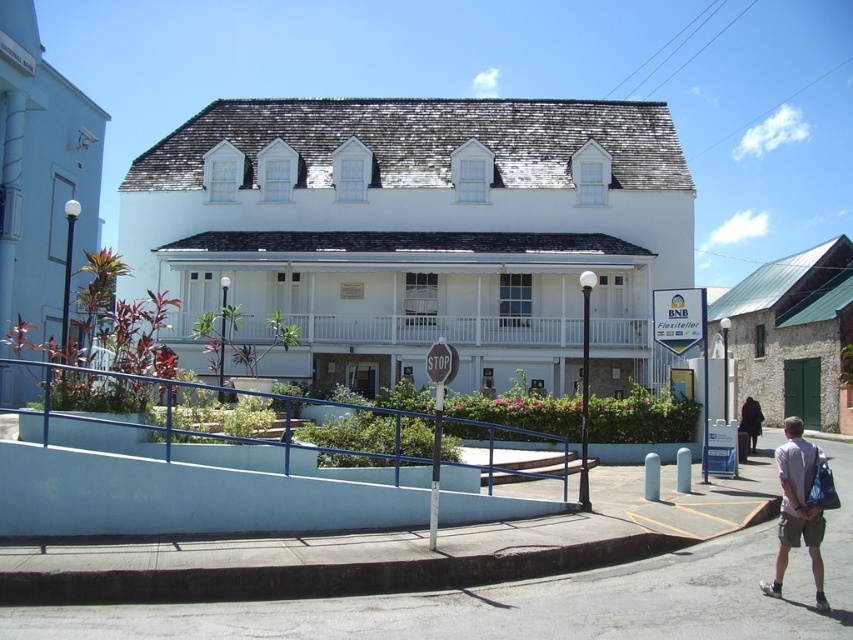
You are a delivery person trying to place a dark brown leather jacket at lower right on the blue metal railing at center. Can you do this without the jacket falling off?

The blue metal railing at center has a lesser height compared to dark brown leather jacket at lower right, so the jacket might not stay securely on the railing and could fall off.

You are a delivery person trying to park your van near the building. The van is 2 meters wide. There is a blue metal railing at center and a dark brown leather jacket at lower right in the image. Which object is wider, and will the van fit between them?

The blue metal railing at center is wider than the dark brown leather jacket at lower right. Since the van is 2 meters wide, it depends on the combined space between them. However, the description only states the railing is wider, not the exact distance. Without knowing the total space, we can only confirm the railing is wider, but cannot determine if the van will fit.

You are standing on the sidewalk near the stop sign and want to reach the building entrance. Which direction should you walk to avoid the blue metal railing at center?

Walk towards the building entrance while staying away from the blue metal railing at center located at point (161,444) to avoid it.